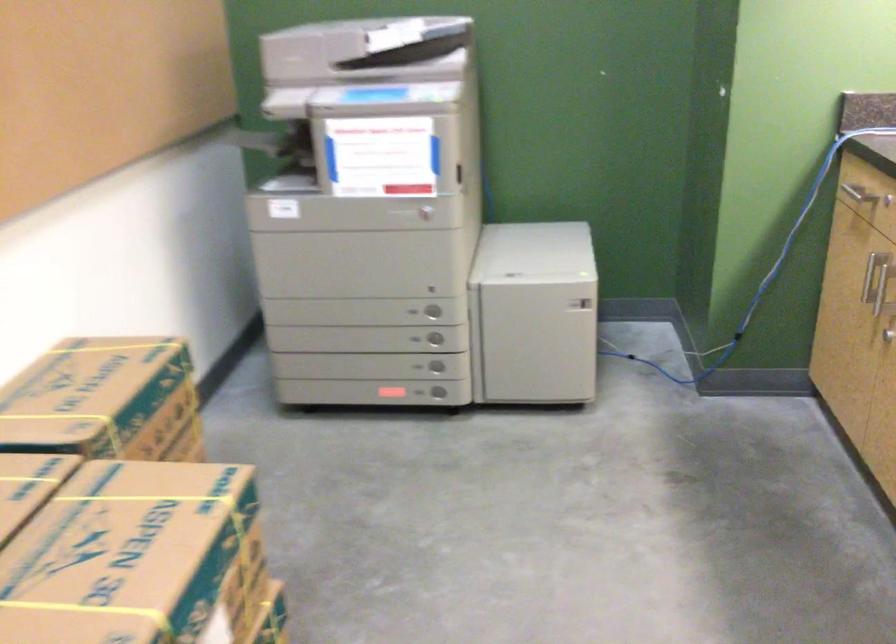
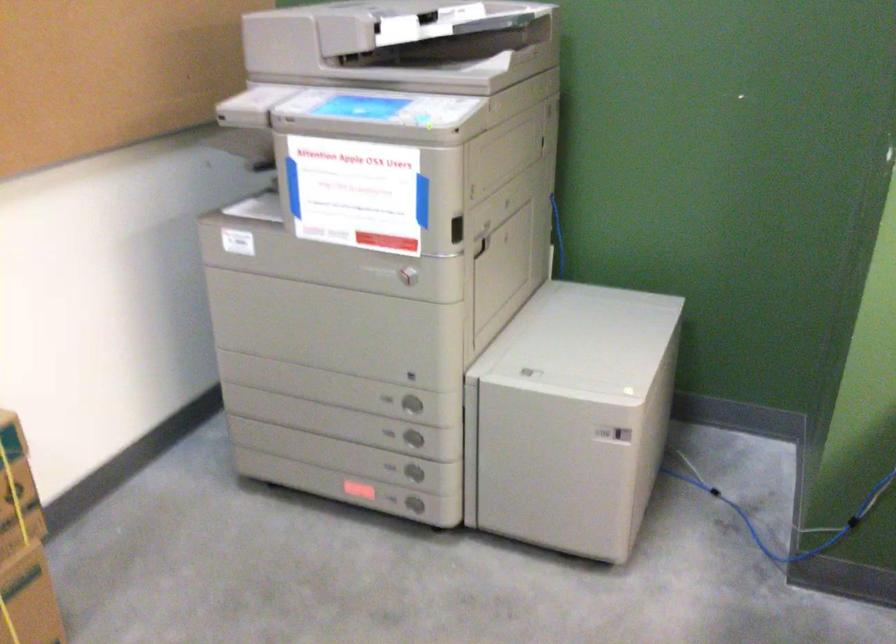
Question: The first image is from the beginning of the video and the second image is from the end. How did the camera likely rotate when shooting the video?

Choices:
 (A) Left
 (B) Right
 (C) Up
 (D) Down

Answer: (A)